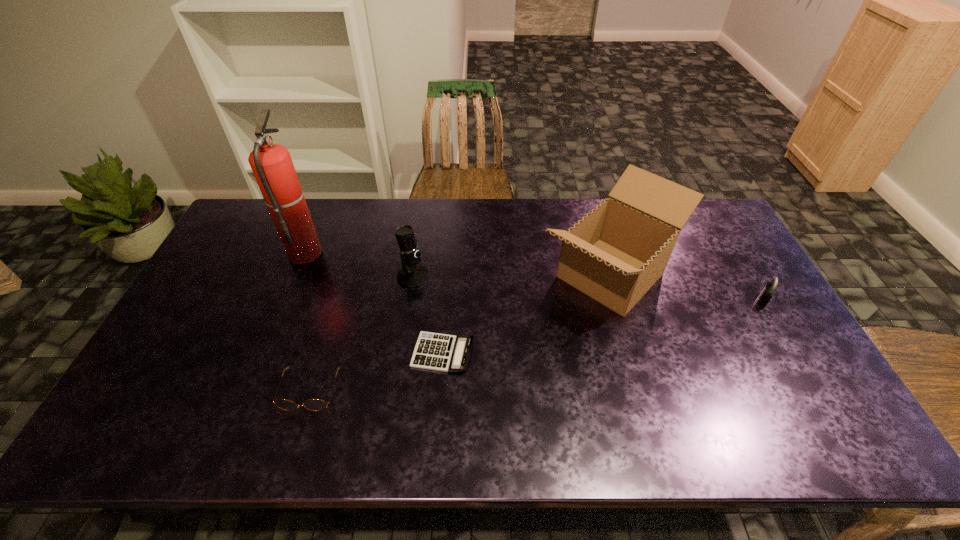
You are a GUI agent. You are given a task and a screenshot of the screen. Output one action in this format:
    pyautogui.click(x=<x>, y=<y>)
    Task: Click on the free region at the left edge of the desktop
    This screenshot has height=540, width=960.
    Given the screenshot: What is the action you would take?
    pyautogui.click(x=184, y=349)

I want to click on vacant area at the right edge, so click(735, 264).

I want to click on free space at the far left corner of the desktop, so click(x=267, y=218).

This screenshot has height=540, width=960. In order to click on vacant space at the near left corner of the desktop in this screenshot , I will do `click(127, 437)`.

This screenshot has width=960, height=540. I want to click on empty space between the second object from left to right and the box, so click(460, 333).

At what (x,y) coordinates should I click in order to perform the action: click on free area in between the fifth object from left to right and the padlock. Please return your answer as a coordinate pair (x, y). The width and height of the screenshot is (960, 540). Looking at the image, I should click on (686, 288).

Find the location of a particular element. This screenshot has width=960, height=540. blank region between the fire extinguisher and the fifth object from left to right is located at coordinates (458, 263).

The height and width of the screenshot is (540, 960). Find the location of `unoccupied position between the box and the microphone`. unoccupied position between the box and the microphone is located at coordinates (512, 276).

The image size is (960, 540). What are the coordinates of `free space that is in between the shortest object and the box` in the screenshot? It's located at (526, 314).

At what (x,y) coordinates should I click in order to perform the action: click on vacant area between the sunglasses and the leftmost object. Please return your answer as a coordinate pair (x, y). This screenshot has height=540, width=960. Looking at the image, I should click on (307, 321).